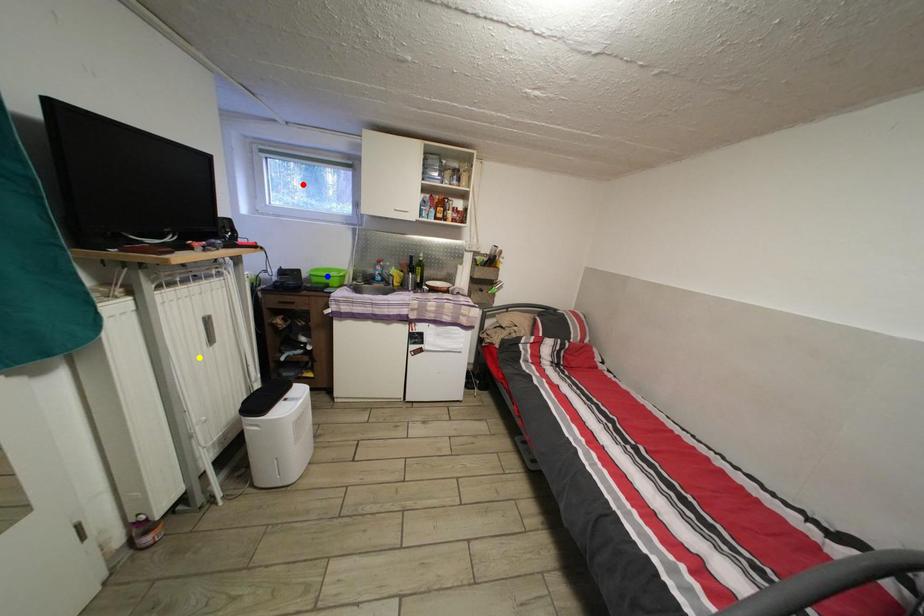
Order these from nearest to farthest:
- red point
- blue point
- yellow point

yellow point → blue point → red point